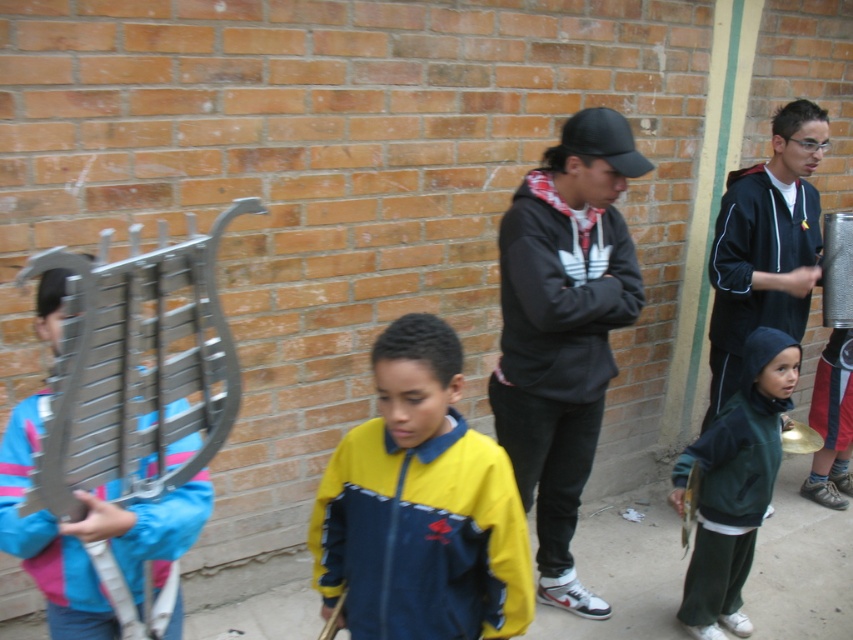
Question: Which point is closer to the camera?

Choices:
 (A) dark green fleece jacket at lower right
 (B) yellow matte jacket at center
 (C) metallic silver lyre at left
 (D) gold metallic bell at lower right

Answer: (C)

Question: Which object is positioned farthest from the black matte jacket at center?

Choices:
 (A) gold metallic bell at lower right
 (B) metallic silver lyre at left
 (C) black fabric jacket at right
 (D) yellow matte jacket at center

Answer: (B)

Question: From the image, what is the correct spatial relationship of black matte jacket at center in relation to metallic silver lyre at left?

Choices:
 (A) right
 (B) left

Answer: (A)

Question: Is black fabric jacket at right thinner than dark green fleece jacket at lower right?

Choices:
 (A) yes
 (B) no

Answer: (B)

Question: Is yellow matte jacket at center wider than gold metallic bell at lower right?

Choices:
 (A) yes
 (B) no

Answer: (A)

Question: Which point is farther to the camera?

Choices:
 (A) (573, 390)
 (B) (151, 448)
 (C) (741, 296)

Answer: (C)